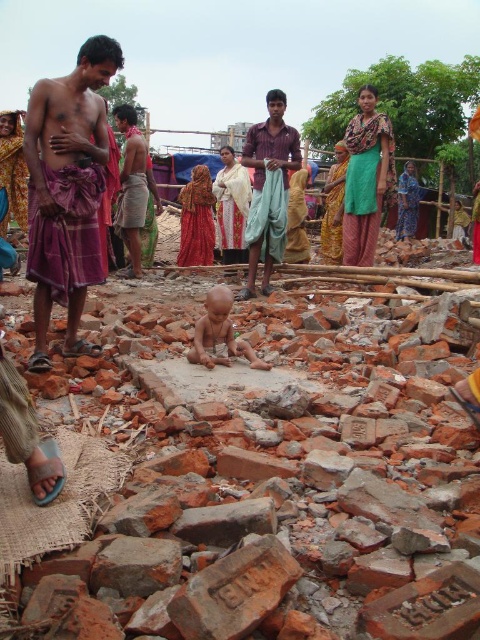
Does matte purple dhoti at center appear on the right side of light brown skin baby at center?

Correct, you'll find matte purple dhoti at center to the right of light brown skin baby at center.

Is matte purple dhoti at center smaller than light brown skin baby at center?

Actually, matte purple dhoti at center might be larger than light brown skin baby at center.

Where is `matte purple dhoti at center`? matte purple dhoti at center is located at coordinates (268, 188).

Image resolution: width=480 pixels, height=640 pixels. Identify the location of matte purple dhoti at center. (268, 188).

Is purple clothed man at left wider than light brown skin baby at center?

Yes, purple clothed man at left is wider than light brown skin baby at center.

Between point (41, 83) and point (218, 333), which one is positioned in front?

Point (41, 83)

You are a GUI agent. You are given a task and a screenshot of the screen. Output one action in this format:
    pyautogui.click(x=<x>, y=<y>)
    Task: Click on the purple clothed man at left
    
    Given the screenshot: What is the action you would take?
    pyautogui.click(x=67, y=189)

Where is `purple clothed man at left`? purple clothed man at left is located at coordinates (67, 189).

Is brown cotton shirt at center to the left of light brown skin baby at center from the viewer's perspective?

Yes, brown cotton shirt at center is to the left of light brown skin baby at center.

Is brown cotton shirt at center positioned at the back of light brown skin baby at center?

Yes, it is.

Find the location of `brown cotton shirt at center`. brown cotton shirt at center is located at coordinates (135, 193).